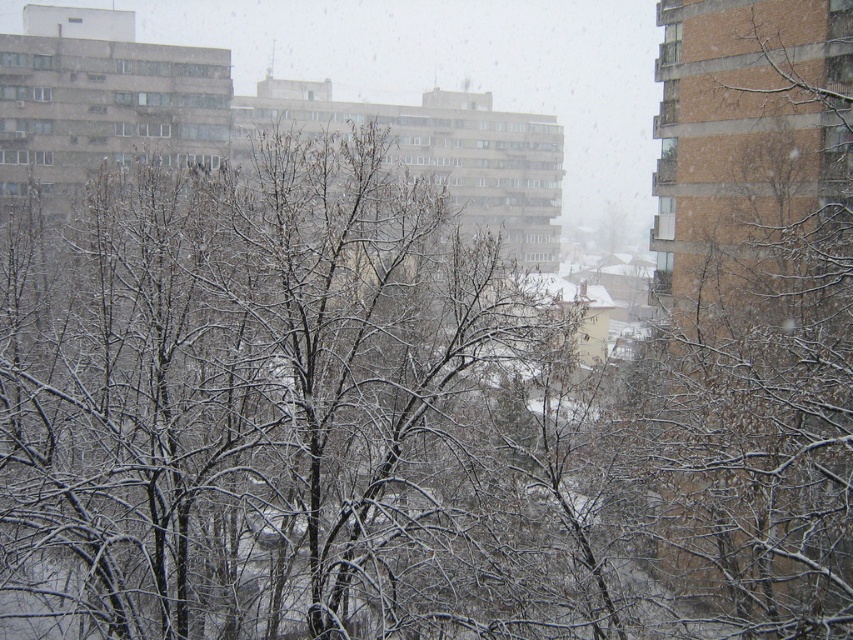
Question: Is snow-covered branches at right smaller than transparent glass window at upper left?

Choices:
 (A) yes
 (B) no

Answer: (B)

Question: Among these objects, which one is nearest to the camera?

Choices:
 (A) clear glass window at upper right
 (B) transparent glass window at upper left
 (C) snow-covered branches at right

Answer: (C)

Question: Which is nearer to the snow-covered branches at right?

Choices:
 (A) clear glass window at upper right
 (B) transparent glass window at upper left

Answer: (A)

Question: Is snow-covered branches at right further to the viewer compared to clear glass window at upper right?

Choices:
 (A) no
 (B) yes

Answer: (A)

Question: Can you confirm if snow-covered branches at right is positioned to the left of transparent glass window at upper left?

Choices:
 (A) yes
 (B) no

Answer: (B)

Question: Which object appears closest to the camera in this image?

Choices:
 (A) clear glass window at upper right
 (B) transparent glass window at upper left

Answer: (A)